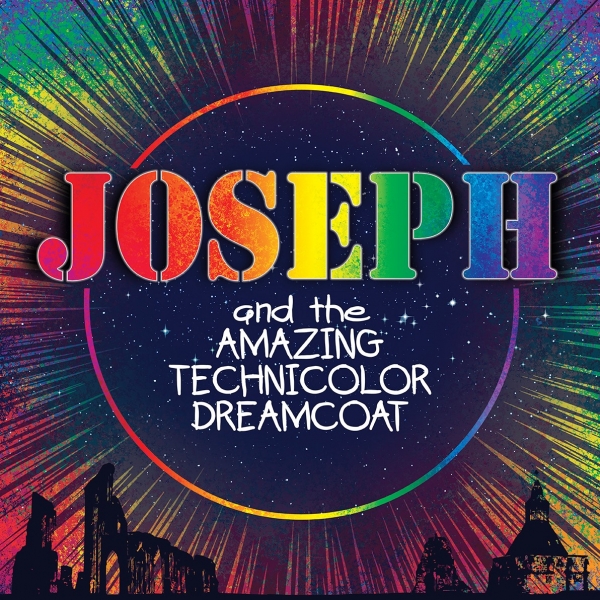
The height and width of the screenshot is (600, 600). Identify the location of beam. (461, 44).